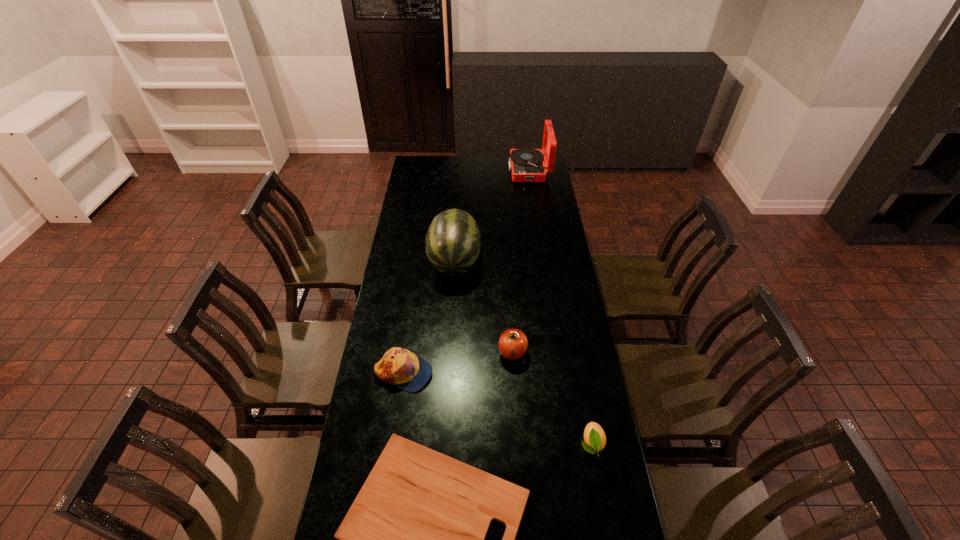
Find the location of a particular element. Image resolution: width=960 pixels, height=540 pixels. free space that is in between the fifth tallest object and the farthest object is located at coordinates (561, 307).

This screenshot has width=960, height=540. I want to click on unoccupied position between the watermelon and the apple, so click(484, 307).

The height and width of the screenshot is (540, 960). Find the location of `empty location between the second shortest object and the apple`. empty location between the second shortest object and the apple is located at coordinates (552, 398).

The height and width of the screenshot is (540, 960). Find the location of `free space that is in between the apple and the phonograph_record`. free space that is in between the apple and the phonograph_record is located at coordinates (520, 261).

The height and width of the screenshot is (540, 960). I want to click on empty space between the fifth nearest object and the cap, so click(429, 318).

Locate an element on the screen. object that is the second closest to the chopping board is located at coordinates (595, 439).

Image resolution: width=960 pixels, height=540 pixels. What are the coordinates of `object that is the closest one to the fourth tallest object` in the screenshot? It's located at (413, 539).

Where is `free space that satisfies the following two spatial constraints: 1. on the front side of the apple; 2. on the bill of the third shortest object`? The height and width of the screenshot is (540, 960). free space that satisfies the following two spatial constraints: 1. on the front side of the apple; 2. on the bill of the third shortest object is located at coordinates (514, 373).